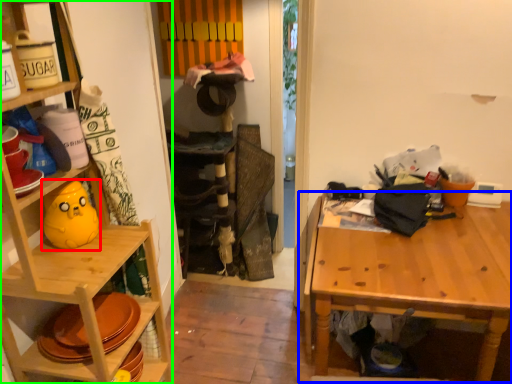
Question: Which object is positioned farthest from toy (highlighted by a red box)? Select from table (highlighted by a blue box) and shelf (highlighted by a green box).

Choices:
 (A) table
 (B) shelf

Answer: (A)